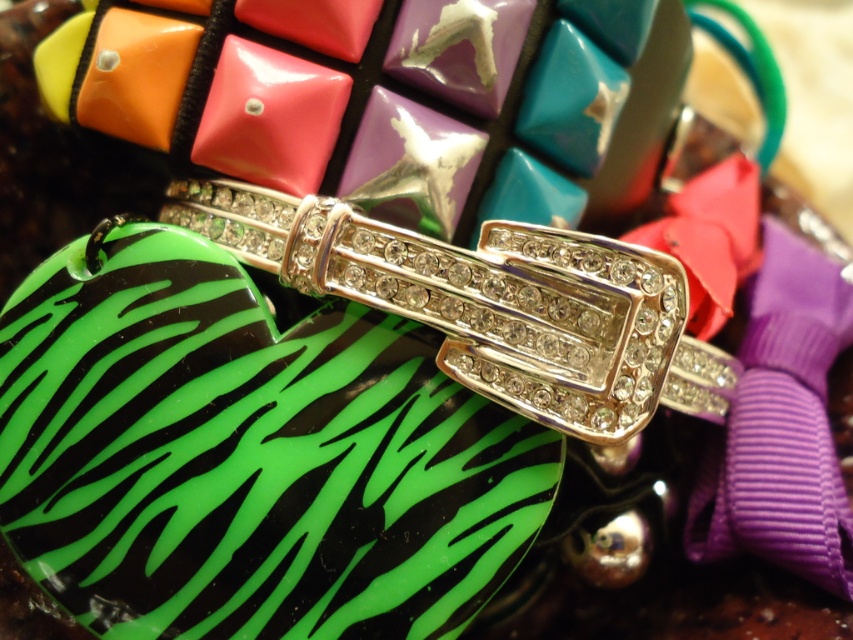
You are a customer at a jewelry store looking at the accessories. You see the gold plated rhinestone ring at center and the matte pink ribbon at center. Which one is positioned to the right side?

The matte pink ribbon at center is positioned to the right side because the gold plated rhinestone ring at center is to the left of it.

You are a jeweler examining the accessories. You need to determine which item has a greater width between the gold plated rhinestone ring at center and the matte pink ribbon at center. Which one is wider?

The gold plated rhinestone ring at center is wider than the matte pink ribbon at center.

You are a jeweler examining the belt and its buckle. You notice a point at coordinates (477, 298). What object is located at this point?

The point at coordinates (477, 298) indicates the gold plated rhinestone ring at center.